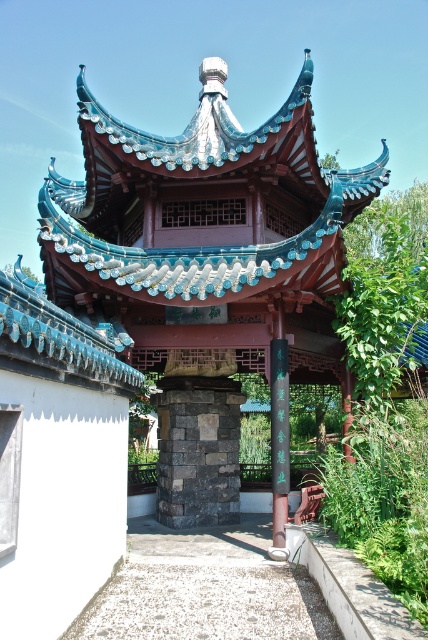
Is dark gray stone pillar at center above black polished wood pole at center?

Incorrect, dark gray stone pillar at center is not positioned above black polished wood pole at center.

Describe the element at coordinates (198, 451) in the screenshot. I see `dark gray stone pillar at center` at that location.

Is point (184, 426) more distant than point (282, 378)?

Yes.

The width and height of the screenshot is (428, 640). Identify the location of dark gray stone pillar at center. (198, 451).